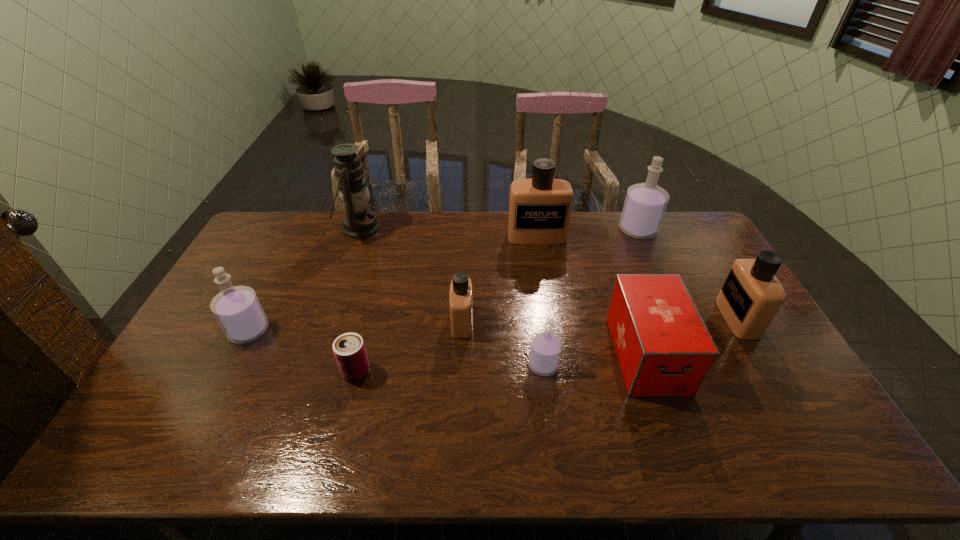
Image resolution: width=960 pixels, height=540 pixels. Find the location of `oil lamp`. oil lamp is located at coordinates (359, 222).

The height and width of the screenshot is (540, 960). Find the location of `rust oil lamp`. rust oil lamp is located at coordinates (359, 222).

Where is `the biggest beige perfume`? the biggest beige perfume is located at coordinates point(540,207).

This screenshot has width=960, height=540. Identify the location of the farthest beige perfume. (540, 207).

This screenshot has width=960, height=540. I want to click on the biggest purple perfume, so click(645, 204).

The image size is (960, 540). I want to click on the rightmost purple perfume, so click(645, 204).

The width and height of the screenshot is (960, 540). I want to click on the leftmost object, so click(x=237, y=309).

Locate an element on the screen. This screenshot has width=960, height=540. the leftmost purple perfume is located at coordinates (237, 309).

The image size is (960, 540). Identify the location of the rightmost beige perfume. (751, 295).

The width and height of the screenshot is (960, 540). I want to click on the rightmost object, so click(x=751, y=295).